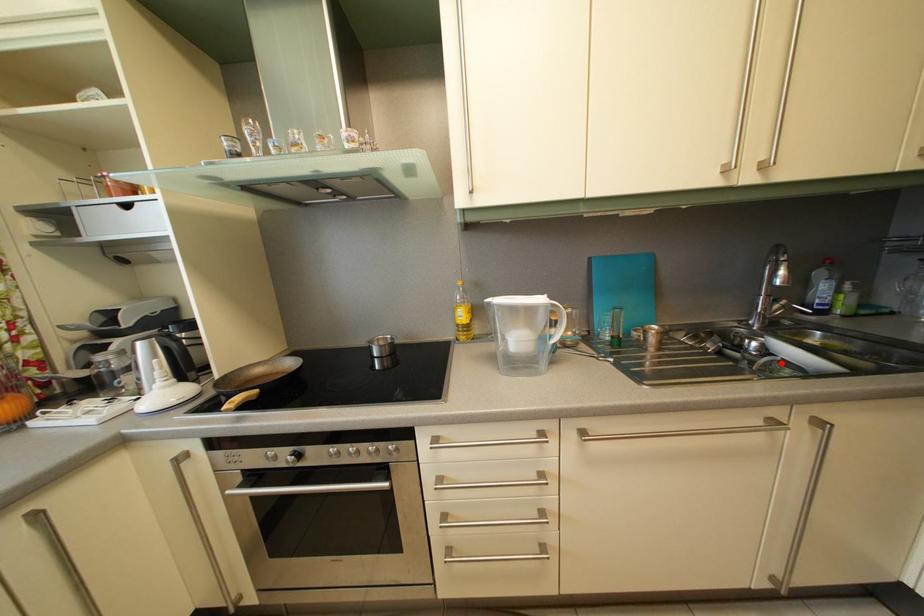
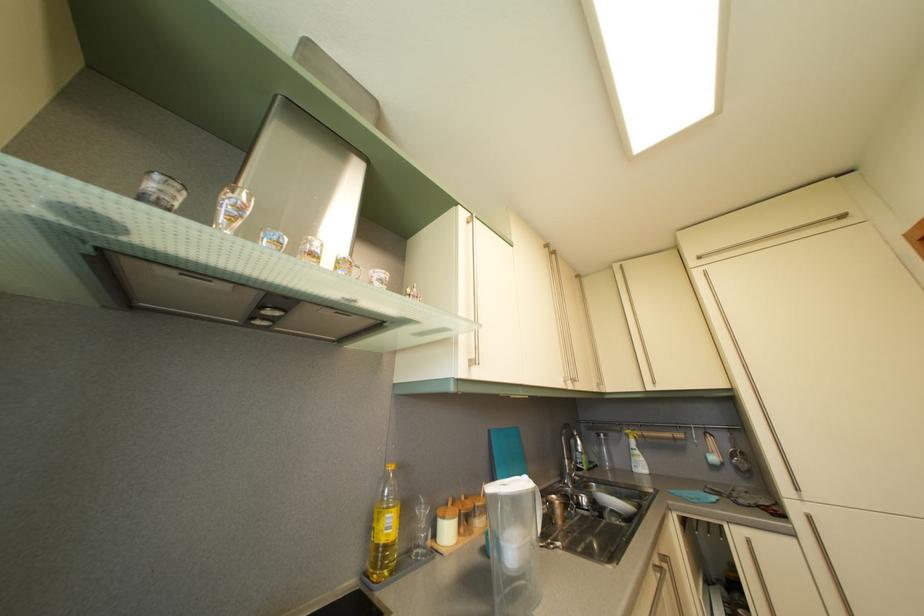
The point at the highlighted location is marked in the first image. Where is the corresponding point in the second image?

(613, 516)